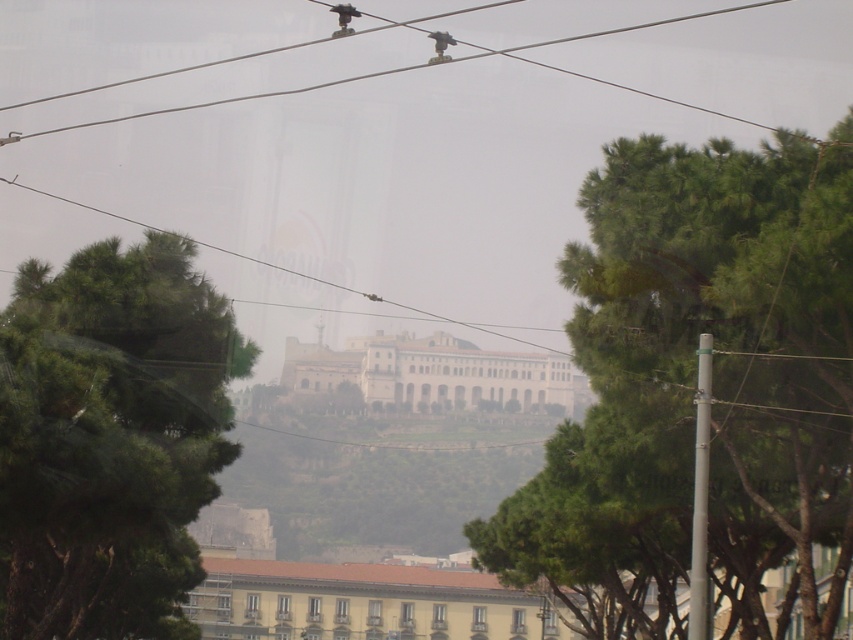
Between point (125, 557) and point (308, 275), which one is positioned behind?

The point (308, 275) is more distant.

Is dark green leafy tree at left to the left of clear wire at center from the viewer's perspective?

Yes, dark green leafy tree at left is to the left of clear wire at center.

Measure the distance between point [119,577] and camera.

Point [119,577] and camera are 65.18 meters apart.

Locate an element on the screen. The image size is (853, 640). dark green leafy tree at left is located at coordinates (109, 438).

Which is in front, point (312, 564) or point (541, 371)?

Point (312, 564) is more forward.

Does white stucco building at center have a lesser width compared to white stone building at center?

Yes, white stucco building at center is thinner than white stone building at center.

What do you see at coordinates (361, 602) in the screenshot? I see `white stucco building at center` at bounding box center [361, 602].

This screenshot has width=853, height=640. What are the coordinates of `white stucco building at center` in the screenshot? It's located at (361, 602).

Between white stucco building at center and clear wire at center, which one is positioned lower?

white stucco building at center

Who is taller, white stucco building at center or clear wire at center?

Standing taller between the two is clear wire at center.

The width and height of the screenshot is (853, 640). What do you see at coordinates (361, 602) in the screenshot?
I see `white stucco building at center` at bounding box center [361, 602].

What are the coordinates of `white stucco building at center` in the screenshot? It's located at (361, 602).